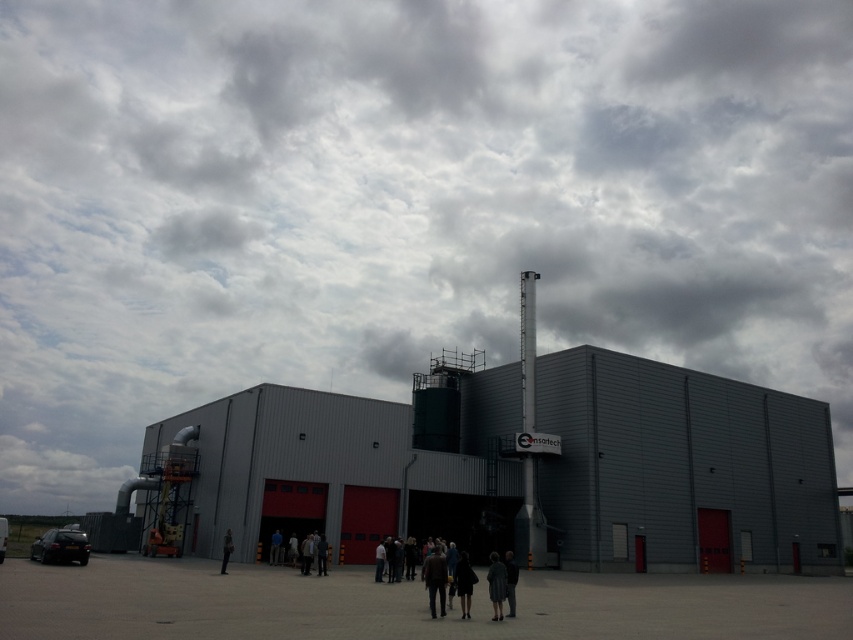
Consider the image. You are a photographer standing in front of the industrial building and see the dark brown leather jacket at center and the dark gray coat at center. Which one is positioned more to the left side from your viewpoint?

The dark brown leather jacket at center is positioned more to the left side from your viewpoint compared to the dark gray coat at center.

You are standing at the origin point of a coordinate system placed over the image. The origin is at the bottom left corner of the image. The x and y axes increase to the right and up respectively. You want to locate the gray metallic building at center. What are its coordinates?

The gray metallic building at center is located at coordinates approximately at point 0.725 on the x axis and 0.618 on the y axis.

Looking at this image, you are a photographer trying to capture a photo of the gray metallic building at center and the dark gray fabric dress at center. Which object should you focus on first if you want to ensure both are in sharp focus?

The gray metallic building at center is taller than the dark gray fabric dress at center, so focusing on the gray metallic building at center first will help ensure both are in sharp focus.